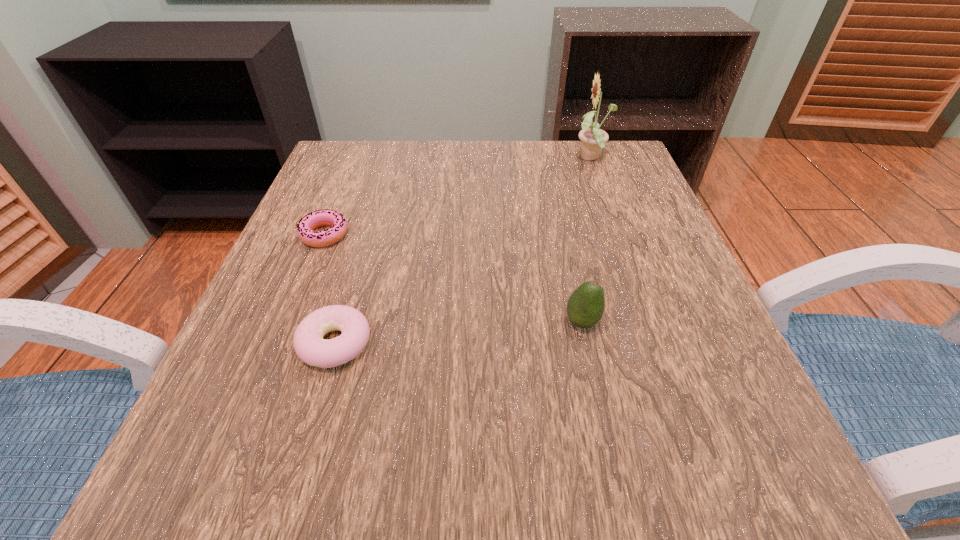
Find the location of a particular element. The width and height of the screenshot is (960, 540). vacant area that lies between the second shortest object and the farthest object is located at coordinates (464, 251).

You are a GUI agent. You are given a task and a screenshot of the screen. Output one action in this format:
    pyautogui.click(x=<x>, y=<y>)
    Task: Click on the free space between the nearer doughnut and the sunflower
    The width and height of the screenshot is (960, 540).
    Given the screenshot: What is the action you would take?
    pyautogui.click(x=464, y=251)

Locate an element on the screen. The height and width of the screenshot is (540, 960). free space between the farther doughnut and the farthest object is located at coordinates (458, 197).

Point out which object is positioned as the second nearest to the farthest object. Please provide its 2D coordinates. Your answer should be formatted as a tuple, i.e. [(x, y)], where the tuple contains the x and y coordinates of a point satisfying the conditions above.

[(326, 217)]

What are the coordinates of `object that is the closest to the third tallest object` in the screenshot? It's located at (326, 217).

You are a GUI agent. You are given a task and a screenshot of the screen. Output one action in this format:
    pyautogui.click(x=<x>, y=<y>)
    Task: Click on the free spot that satisfies the following two spatial constraints: 1. on the front-facing side of the rightmost object; 2. on the front side of the nearer doughnut
    This screenshot has width=960, height=540.
    Given the screenshot: What is the action you would take?
    pyautogui.click(x=659, y=343)

I want to click on free region that satisfies the following two spatial constraints: 1. on the front-facing side of the rightmost object; 2. on the front side of the second tallest object, so click(x=651, y=322).